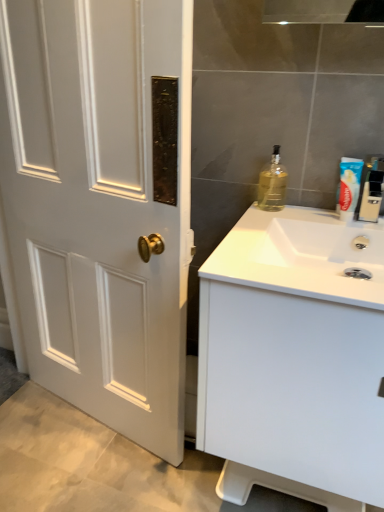
Question: Is white matte cabinet at right wider than translucent glass bottle at upper right, which ranks as the 1th bottle in left-to-right order?

Choices:
 (A) no
 (B) yes

Answer: (B)

Question: From a real-world perspective, does white matte cabinet at right stand above translucent glass bottle at upper right, which ranks as the 1th bottle in left-to-right order?

Choices:
 (A) no
 (B) yes

Answer: (A)

Question: Is white matte cabinet at right positioned behind translucent glass bottle at upper right, which ranks as the 1th bottle in left-to-right order?

Choices:
 (A) no
 (B) yes

Answer: (A)

Question: Would you say white matte cabinet at right is a long distance from translucent glass bottle at upper right, which ranks as the 1th bottle in left-to-right order?

Choices:
 (A) yes
 (B) no

Answer: (B)

Question: Can you confirm if white matte cabinet at right is bigger than translucent glass bottle at upper right, the second bottle in the right-to-left sequence?

Choices:
 (A) yes
 (B) no

Answer: (A)

Question: Looking at the image, does translucent glass bottle at upper right, which ranks as the 1th bottle in left-to-right order, seem bigger or smaller compared to white glossy sink at right?

Choices:
 (A) big
 (B) small

Answer: (B)

Question: From a real-world perspective, is translucent glass bottle at upper right, the second bottle in the right-to-left sequence, physically located above or below white glossy sink at right?

Choices:
 (A) below
 (B) above

Answer: (B)

Question: Which is correct: translucent glass bottle at upper right, which ranks as the 1th bottle in left-to-right order, is inside white glossy sink at right, or outside of it?

Choices:
 (A) outside
 (B) inside

Answer: (A)

Question: In terms of height, does translucent glass bottle at upper right, which ranks as the 1th bottle in left-to-right order, look taller or shorter compared to white glossy sink at right?

Choices:
 (A) short
 (B) tall

Answer: (B)

Question: Does point (367, 204) appear closer or farther from the camera than point (243, 246)?

Choices:
 (A) farther
 (B) closer

Answer: (A)

Question: Considering the positions of clear plastic toothpaste tube at upper right, which appears as the second bottle when viewed from the left, and white glossy sink at right in the image, is clear plastic toothpaste tube at upper right, which appears as the second bottle when viewed from the left, wider or thinner than white glossy sink at right?

Choices:
 (A) wide
 (B) thin

Answer: (B)

Question: From the image's perspective, is clear plastic toothpaste tube at upper right, which appears as the second bottle when viewed from the left, positioned above or below white glossy sink at right?

Choices:
 (A) above
 (B) below

Answer: (A)

Question: Is clear plastic toothpaste tube at upper right, marked as the first bottle in a right-to-left arrangement, inside the boundaries of white glossy sink at right, or outside?

Choices:
 (A) outside
 (B) inside

Answer: (A)

Question: Considering their positions, is blue plastic toothpaste at upper right located in front of or behind white matte cabinet at right?

Choices:
 (A) front
 (B) behind

Answer: (B)

Question: From a real-world perspective, is blue plastic toothpaste at upper right physically located above or below white matte cabinet at right?

Choices:
 (A) above
 (B) below

Answer: (A)